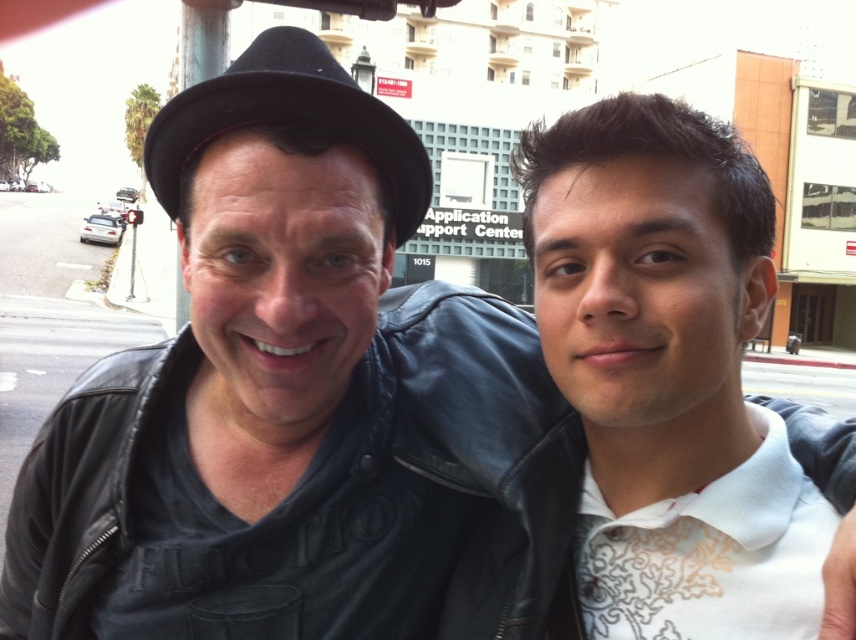
You are a photographer trying to capture a closeup of the white textured shirt at center and the black felt plug hat at upper left. Since you want both items to appear the same size in the photo, which object should you move closer to the camera and which should you move farther away?

The white textured shirt at center has a lesser width compared to the black felt plug hat at upper left. To make them appear the same size in the photo, move the white textured shirt at center closer to the camera and move the black felt plug hat at upper left farther away.

You are standing in front of the Application Support Center at 1015. There is a point marked at coordinates (x=746, y=456). If you want to touch this point with your hand, which direction should you move your hand relative to your body?

The point at coordinates (x=746, y=456) is 1.28 meters away from the camera, so you should extend your hand forward to reach it.

You are a photographer setting up a tripod to take a group photo of the two people in the image. The tripod has a height limit of 1.8 meters. Based on the scene, will the white textured shirt at center and the black felt plug hat at upper left fit within the tripod height limit?

The white textured shirt at center is much taller than the black felt plug hat at upper left. Since the tripod has a height limit of 1.8 meters, both objects should fit within the height limit as their combined height is likely under 1.8 meters.